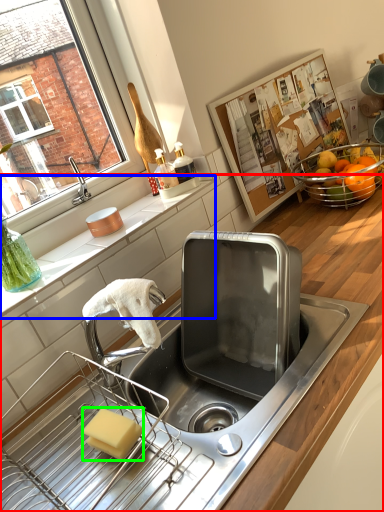
Question: Considering the real-world distances, which object is farthest from countertop (highlighted by a red box)? countertop (highlighted by a blue box) or soap (highlighted by a green box)?

Choices:
 (A) countertop
 (B) soap

Answer: (B)